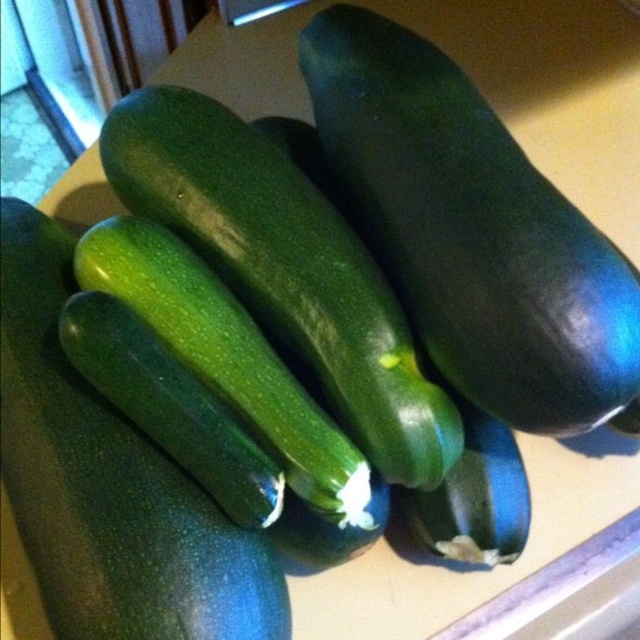
Question: Can you confirm if green matte cucumber at center is positioned to the left of green smooth zucchini at center?

Choices:
 (A) yes
 (B) no

Answer: (B)

Question: Which of the following is the farthest from the observer?

Choices:
 (A) (516, 220)
 (B) (332, 262)
 (C) (208, 588)

Answer: (B)

Question: Where is green matte cucumber at center located in relation to green smooth zucchini at center in the image?

Choices:
 (A) below
 (B) above

Answer: (B)

Question: Is green matte cucumber at center further to the viewer compared to green smooth skin cucumber at center?

Choices:
 (A) yes
 (B) no

Answer: (B)

Question: Which of the following is the closest to the observer?

Choices:
 (A) (352, 403)
 (B) (234, 536)
 (C) (449, 362)

Answer: (B)

Question: Which of the following is the farthest from the observer?

Choices:
 (A) (534, 280)
 (B) (131, 188)
 (C) (68, 579)

Answer: (B)